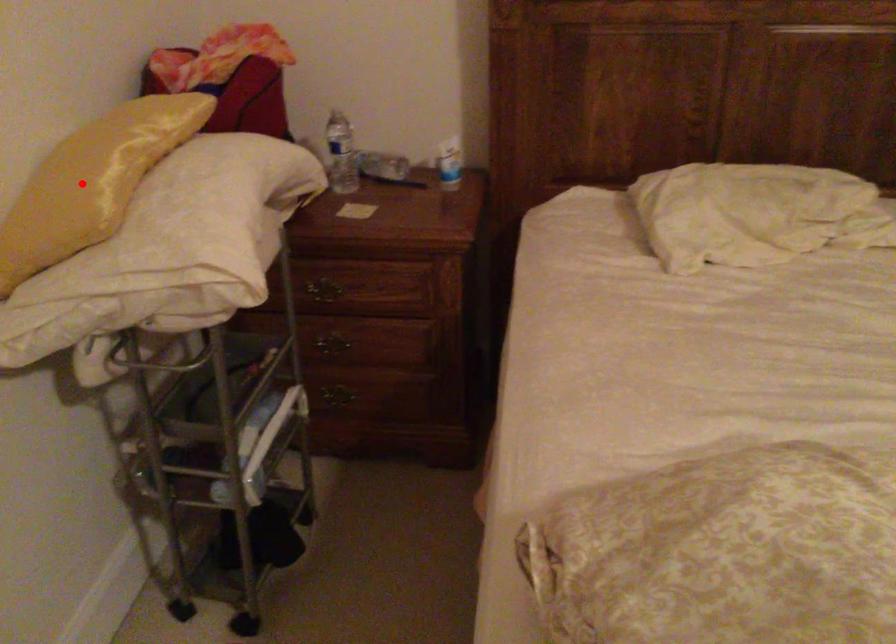
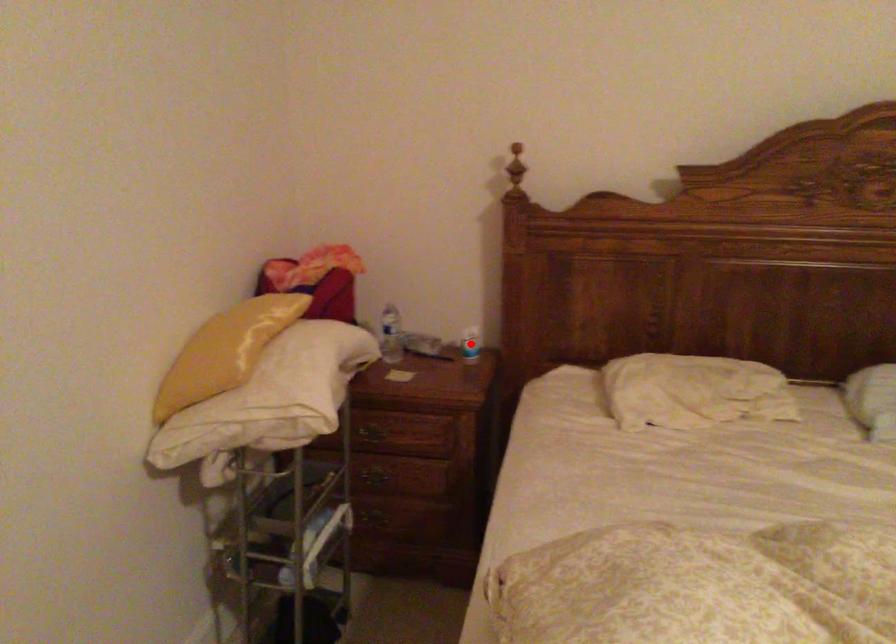
I am providing you with two images of the same scene from different viewpoints. A red point is marked on the first image and another point is marked on the second image. Does the point marked in image1 correspond to the same location as the one in image2?

No